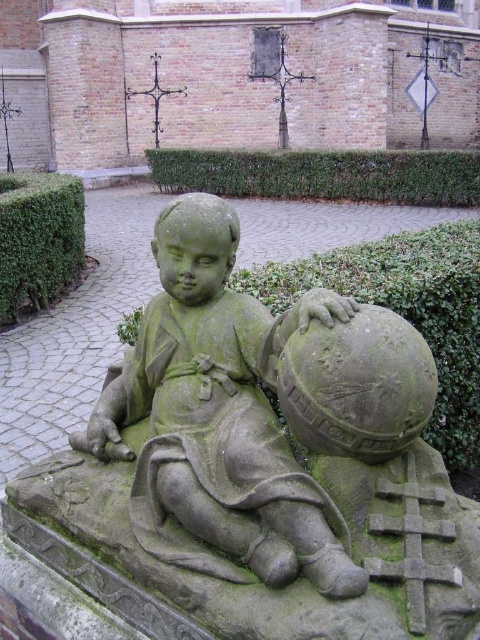
You are an artist planning to paint the scene in front of you. You need to decide which object to paint first based on their sizes. According to the description, which object should you start with, the green stone statue at center or the green hedge at upper left?

The green stone statue at center has a smaller size compared to the green hedge at upper left. Therefore, you should start painting the green stone statue at center first since it is smaller and may require more detailed work up close before tackling larger elements like the green hedge at upper left.

You are a landscape architect planning to install a new pathway between the green stone statue at center and the green hedge at upper left. The pathway requires a minimum of 20 feet of space. Can the pathway be installed between them?

The green stone statue at center is 21.37 feet away from the green hedge at upper left, which exceeds the required 20 feet, so the pathway can be installed between them.

You are a gardener planning to trim the green hedge at upper left. To avoid damaging the green stone statue at center, which direction should you move the hedge so it doesn

The green stone statue at center is located below the green hedge at upper left. To prevent damaging the statue, you should move the hedge upward or to the left to create more space between them.